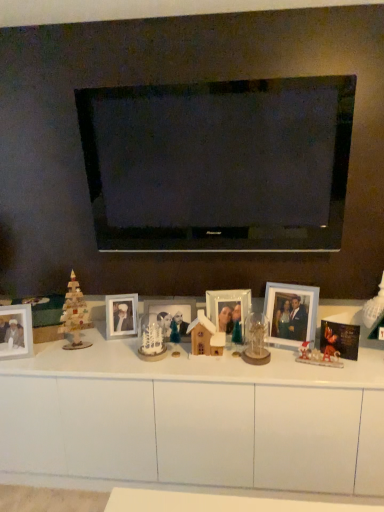
The height and width of the screenshot is (512, 384). I want to click on vacant area that lies to the right of wooden christmas tree at left, so click(112, 349).